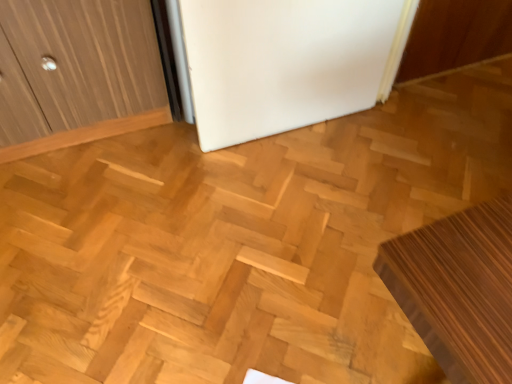
Image resolution: width=512 pixels, height=384 pixels. Identify the location of vacant space underneath white matte refrigerator at center (from a real-world perspective). (280, 135).